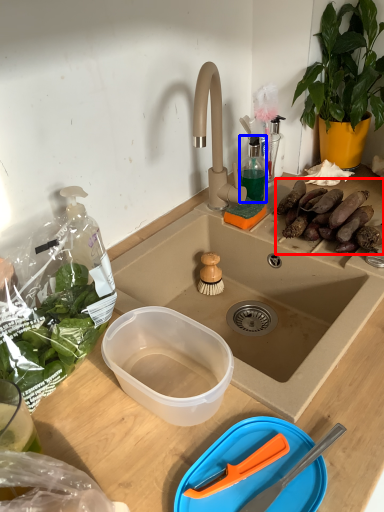
Question: Which point is further to the camera, food (highlighted by a red box) or bottle (highlighted by a blue box)?

Choices:
 (A) food
 (B) bottle

Answer: (B)